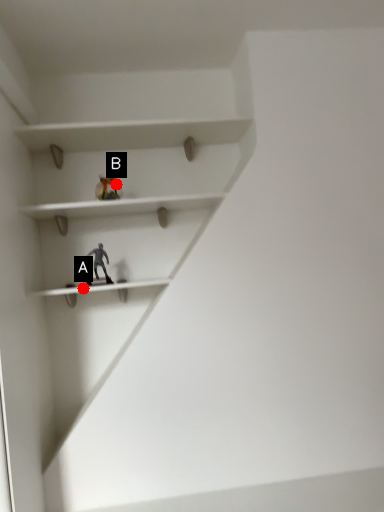
Question: Two points are circled on the image, labeled by A and B beside each circle. Which of the following is the farthest from the observer?

Choices:
 (A) A is further
 (B) B is further

Answer: (B)